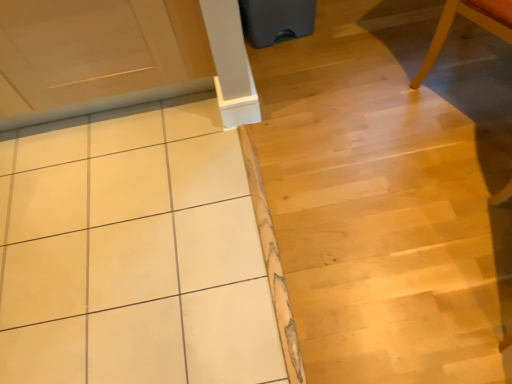
Question: Considering the relative sizes of light wood chair at upper right and white tile at upper left in the image provided, is light wood chair at upper right bigger than white tile at upper left?

Choices:
 (A) yes
 (B) no

Answer: (B)

Question: Is light wood chair at upper right at the right side of white tile at upper left?

Choices:
 (A) yes
 (B) no

Answer: (A)

Question: Does light wood chair at upper right have a lesser width compared to white tile at upper left?

Choices:
 (A) yes
 (B) no

Answer: (A)

Question: Does light wood chair at upper right have a smaller size compared to white tile at upper left?

Choices:
 (A) no
 (B) yes

Answer: (B)

Question: Is the surface of light wood chair at upper right in direct contact with white tile at upper left?

Choices:
 (A) no
 (B) yes

Answer: (A)

Question: Is point (460, 0) closer or farther from the camera than point (101, 274)?

Choices:
 (A) closer
 (B) farther

Answer: (A)

Question: From their relative heights in the image, would you say light wood chair at upper right is taller or shorter than white glossy tile at center?

Choices:
 (A) short
 (B) tall

Answer: (B)

Question: Is light wood chair at upper right wider or thinner than white glossy tile at center?

Choices:
 (A) wide
 (B) thin

Answer: (B)

Question: From a real-world perspective, is light wood chair at upper right above or below white glossy tile at center?

Choices:
 (A) below
 (B) above

Answer: (B)

Question: Do you think white glossy tile at center is within light wood chair at upper right, or outside of it?

Choices:
 (A) inside
 (B) outside

Answer: (B)

Question: From the image's perspective, is white glossy tile at center located above or below light wood chair at upper right?

Choices:
 (A) below
 (B) above

Answer: (A)

Question: Is white glossy tile at center in front of or behind light wood chair at upper right in the image?

Choices:
 (A) front
 (B) behind

Answer: (B)

Question: Considering the positions of white glossy tile at center and light wood chair at upper right in the image, is white glossy tile at center taller or shorter than light wood chair at upper right?

Choices:
 (A) tall
 (B) short

Answer: (B)

Question: From their relative heights in the image, would you say white tile at upper left is taller or shorter than light wood chair at upper right?

Choices:
 (A) tall
 (B) short

Answer: (B)

Question: From a real-world perspective, is white tile at upper left above or below light wood chair at upper right?

Choices:
 (A) above
 (B) below

Answer: (B)